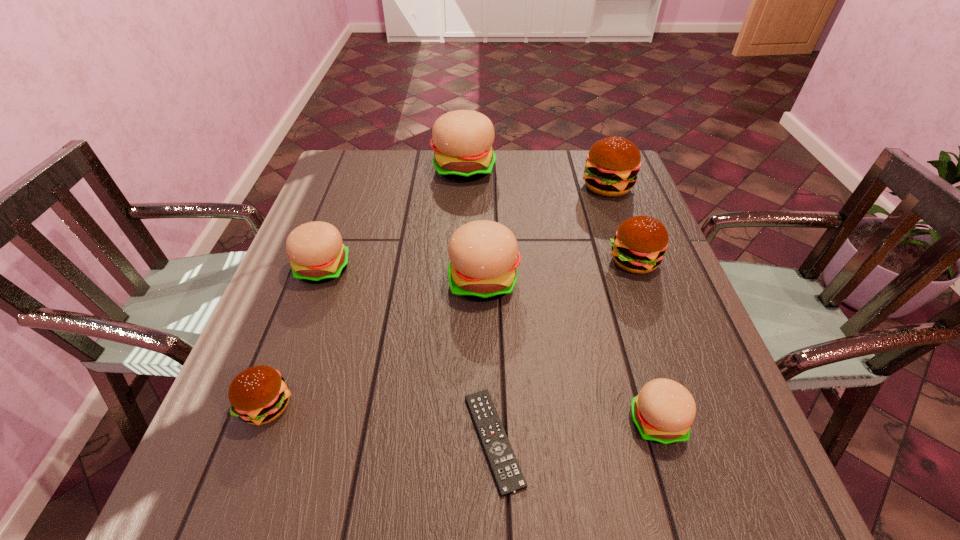
At what (x,y) coordinates should I click in order to perform the action: click on vacant area that lies between the second nearest brown hamburger and the smallest beige hamburger. Please return your answer as a coordinate pair (x, y). Looking at the image, I should click on (645, 341).

What are the coordinates of `empty space that is in between the biggest brown hamburger and the shortest object` in the screenshot? It's located at (551, 313).

Where is `vacant point located between the second biggest beige hamburger and the biggest brown hamburger`? This screenshot has height=540, width=960. vacant point located between the second biggest beige hamburger and the biggest brown hamburger is located at coordinates (545, 234).

Identify which object is the closest to the second nearest brown hamburger. Please provide its 2D coordinates. Your answer should be formatted as a tuple, i.e. [(x, y)], where the tuple contains the x and y coordinates of a point satisfying the conditions above.

[(612, 164)]

This screenshot has width=960, height=540. What are the coordinates of `the fourth closest object to the biggest brown hamburger` in the screenshot? It's located at (663, 411).

Select which hamburger is the sixth closest to the third biggest beige hamburger. Please provide its 2D coordinates. Your answer should be formatted as a tuple, i.e. [(x, y)], where the tuple contains the x and y coordinates of a point satisfying the conditions above.

[(612, 164)]

Locate which hamburger is the fifth closest to the third smallest beige hamburger. Please provide its 2D coordinates. Your answer should be formatted as a tuple, i.e. [(x, y)], where the tuple contains the x and y coordinates of a point satisfying the conditions above.

[(462, 140)]

Locate an element on the screen. the second closest beige hamburger to the second biggest beige hamburger is located at coordinates (663, 411).

Identify which beige hamburger is the closest to the leftmost brown hamburger. Please provide its 2D coordinates. Your answer should be formatted as a tuple, i.e. [(x, y)], where the tuple contains the x and y coordinates of a point satisfying the conditions above.

[(317, 254)]

Locate an element on the screen. brown hamburger that can be found as the second closest to the smallest brown hamburger is located at coordinates (612, 164).